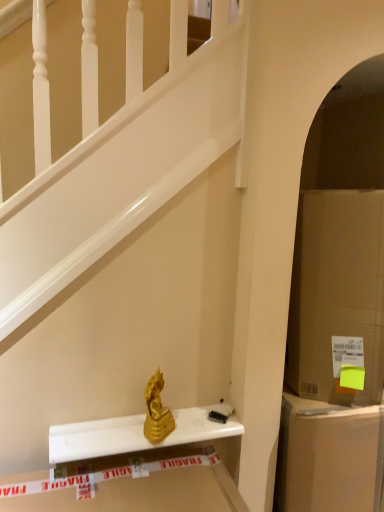
Question: Is cardboard box at right not close to cardboard box at right?

Choices:
 (A) yes
 (B) no

Answer: (B)

Question: Considering the relative positions of cardboard box at right and cardboard box at right in the image provided, is cardboard box at right to the left of cardboard box at right from the viewer's perspective?

Choices:
 (A) yes
 (B) no

Answer: (A)

Question: Is cardboard box at right not inside cardboard box at right?

Choices:
 (A) yes
 (B) no

Answer: (A)

Question: From a real-world perspective, does cardboard box at right sit lower than cardboard box at right?

Choices:
 (A) yes
 (B) no

Answer: (A)

Question: From the image's perspective, is cardboard box at right above cardboard box at right?

Choices:
 (A) no
 (B) yes

Answer: (A)

Question: Choose the correct answer: Is cardboard box at right inside gold metallic statue at center or outside it?

Choices:
 (A) outside
 (B) inside

Answer: (A)

Question: Considering the positions of point (377, 303) and point (160, 388), is point (377, 303) closer or farther from the camera than point (160, 388)?

Choices:
 (A) farther
 (B) closer

Answer: (A)

Question: From the image's perspective, is cardboard box at right above or below gold metallic statue at center?

Choices:
 (A) below
 (B) above

Answer: (B)

Question: From their relative heights in the image, would you say cardboard box at right is taller or shorter than gold metallic statue at center?

Choices:
 (A) tall
 (B) short

Answer: (A)

Question: Is gold metallic statue at center to the left or to the right of cardboard box at right in the image?

Choices:
 (A) left
 (B) right

Answer: (A)

Question: Is gold metallic statue at center spatially inside cardboard box at right, or outside of it?

Choices:
 (A) inside
 (B) outside

Answer: (B)

Question: In the image, is gold metallic statue at center positioned in front of or behind cardboard box at right?

Choices:
 (A) behind
 (B) front

Answer: (B)

Question: From a real-world perspective, is gold metallic statue at center physically located above or below cardboard box at right?

Choices:
 (A) above
 (B) below

Answer: (A)

Question: Is cardboard box at right wider or thinner than cardboard box at right?

Choices:
 (A) thin
 (B) wide

Answer: (B)

Question: Looking at the image, does cardboard box at right seem bigger or smaller compared to cardboard box at right?

Choices:
 (A) small
 (B) big

Answer: (B)